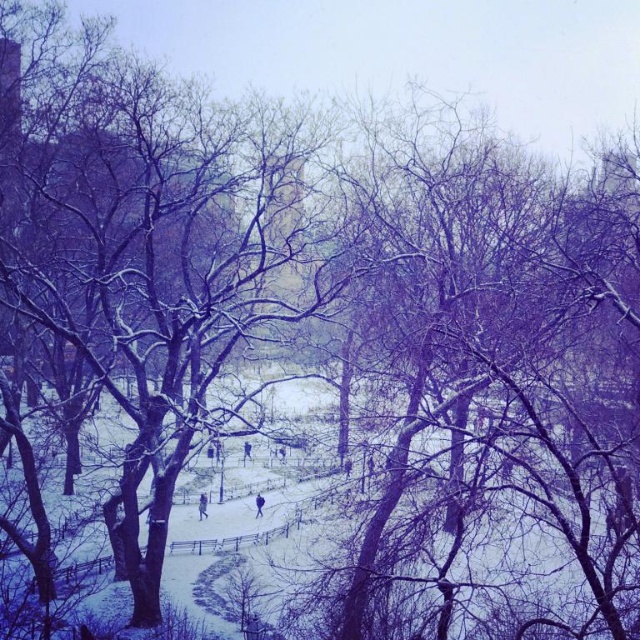
You are standing at the edge of the snow path in the winter park scene. You see two points marked in the image. Which point, point (200, 518) or point (256, 515), is closer to you?

Point (200, 518) is closer to you because it is further to the viewer than point (256, 515).

Looking at this image, you are standing at the edge of the snow path and want to approach the blue fabric jacket at center. However, there is a purple fabric person at lower center blocking your way. Can you walk around them without going off the path?

The purple fabric person at lower center is closer to you than the blue fabric jacket at center, so you can walk around them while staying on the path.

You are standing on the snow path and want to take a photo of the purple fabric person at lower center and the blue fabric jacket at center. Which one should you zoom in more on to capture their full height in the frame?

The purple fabric person at lower center is much taller than the blue fabric jacket at center, so you should zoom in more on the purple fabric person at lower center to capture their full height in the frame.